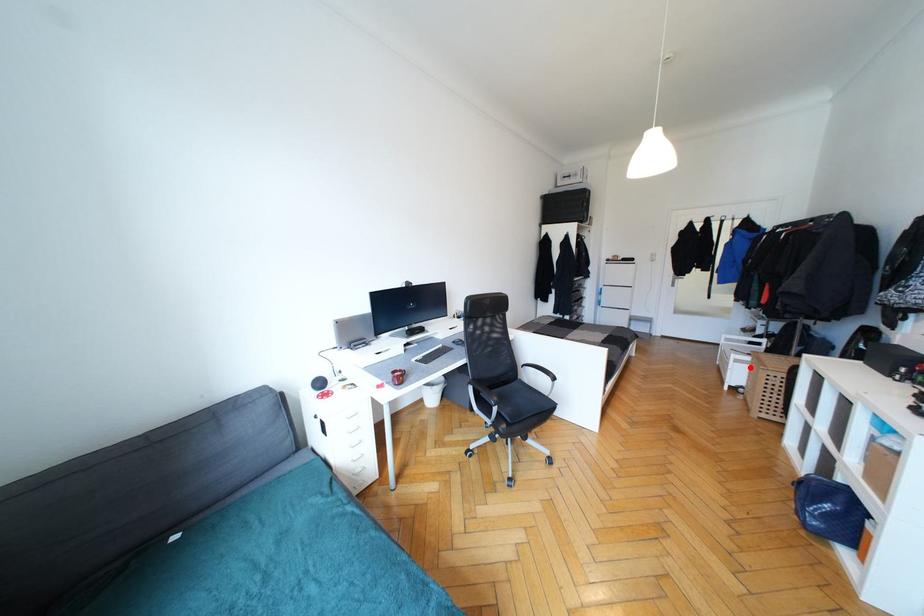
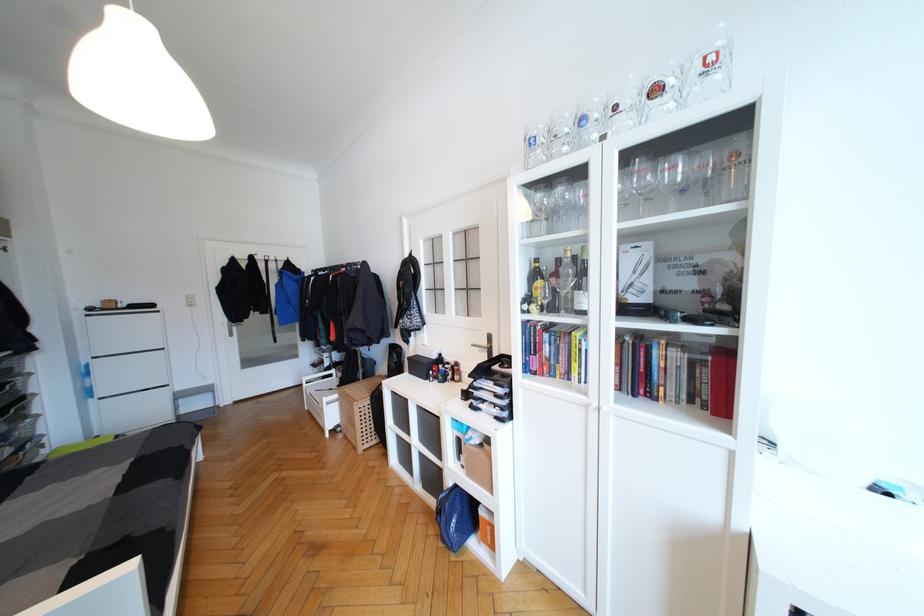
Question: I am providing you with two images of the same scene from different viewpoints. In image1, a red point is highlighted. Considering the same 3D point in image2, which of the following is correct?

Choices:
 (A) It is closer
 (B) It is farther

Answer: (B)